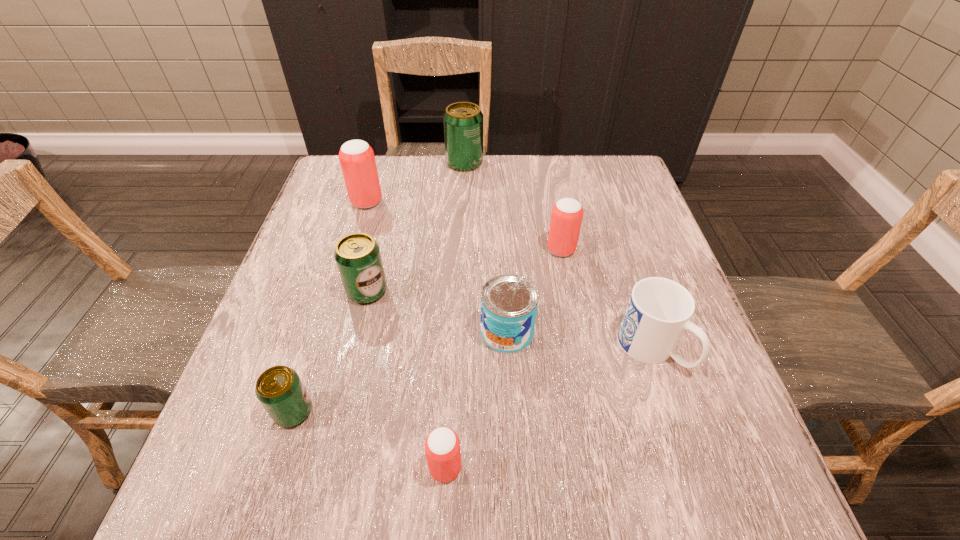
Select which beer can appears as the closest to the biggest green beer can. Please provide its 2D coordinates. Your answer should be formatted as a tuple, i.e. [(x, y)], where the tuple contains the x and y coordinates of a point satisfying the conditions above.

[(357, 159)]

In order to click on green beer can that can be found as the closest to the third nearest beer can in this screenshot , I will do `click(279, 389)`.

Image resolution: width=960 pixels, height=540 pixels. Identify the location of the second closest green beer can to the second nearest beer can. (463, 121).

Select which red beer can appears as the closest to the rightmost beer can. Please provide its 2D coordinates. Your answer should be formatted as a tuple, i.e. [(x, y)], where the tuple contains the x and y coordinates of a point satisfying the conditions above.

[(357, 159)]

At what (x,y) coordinates should I click in order to perform the action: click on the second closest red beer can to the fifth nearest beer can. Please return your answer as a coordinate pair (x, y). The image size is (960, 540). Looking at the image, I should click on (442, 446).

Identify the location of free space in the image that satisfies the following two spatial constraints: 1. on the back side of the nearest green beer can; 2. on the left side of the second farthest object. (360, 202).

The image size is (960, 540). Identify the location of vacant region that satisfies the following two spatial constraints: 1. on the front side of the blue mug; 2. on the right side of the second biggest green beer can. (353, 348).

Identify the location of free spot that satisfies the following two spatial constraints: 1. on the back side of the farthest red beer can; 2. on the right side of the farthest green beer can. (378, 163).